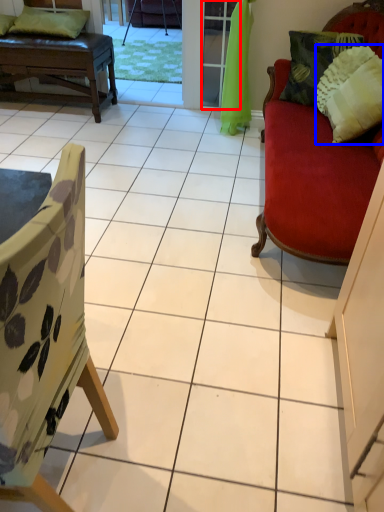
Question: Among these objects, which one is nearest to the camera, screen door (highlighted by a red box) or pillow (highlighted by a blue box)?

Choices:
 (A) screen door
 (B) pillow

Answer: (B)